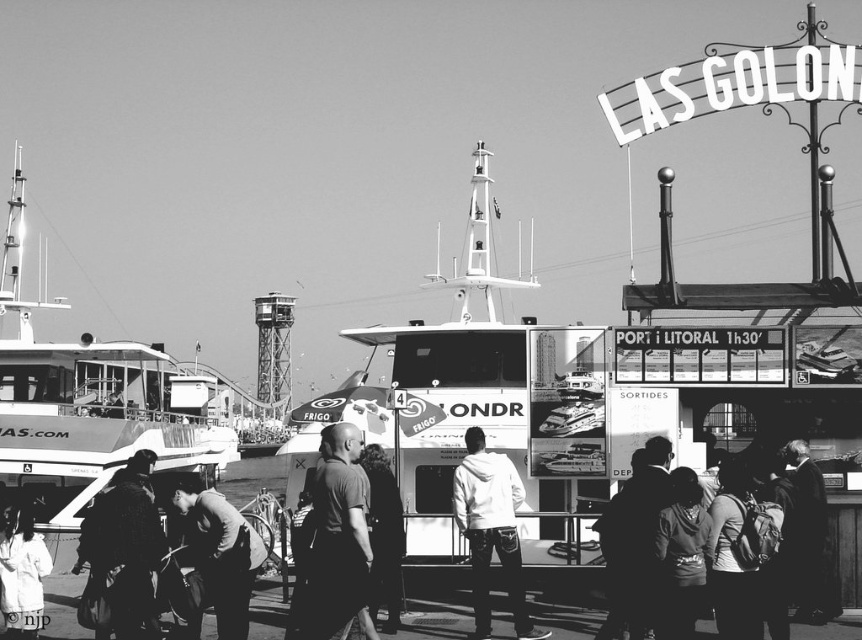
Does point (570, 522) come farther from viewer compared to point (820, 490)?

Yes, point (570, 522) is farther from viewer.

Image resolution: width=862 pixels, height=640 pixels. Describe the element at coordinates (445, 385) in the screenshot. I see `white matte boat at center` at that location.

Is point (514, 278) positioned behind point (798, 472)?

Yes, point (514, 278) is farther from viewer.

Image resolution: width=862 pixels, height=640 pixels. I want to click on white matte boat at center, so click(x=445, y=385).

Based on the photo, is dark gray fabric jacket at center shorter than white cotton shirt at lower left?

No.

Who is more distant from viewer, (382, 556) or (41, 602)?

Point (41, 602)

Between point (376, 490) and point (29, 589), which one is positioned in front?

Point (376, 490)

The image size is (862, 640). Identify the location of dark gray fabric jacket at center. (384, 536).

Is dark textured backpack at lower left thinner than white matte hoodie at center?

No.

Does dark textured backpack at lower left have a larger size compared to white matte hoodie at center?

Yes, dark textured backpack at lower left is bigger than white matte hoodie at center.

Who is more forward, [139,513] or [458,508]?

Point [139,513] is in front.

Identify the location of dark textured backpack at lower left. The image size is (862, 640). (122, 556).